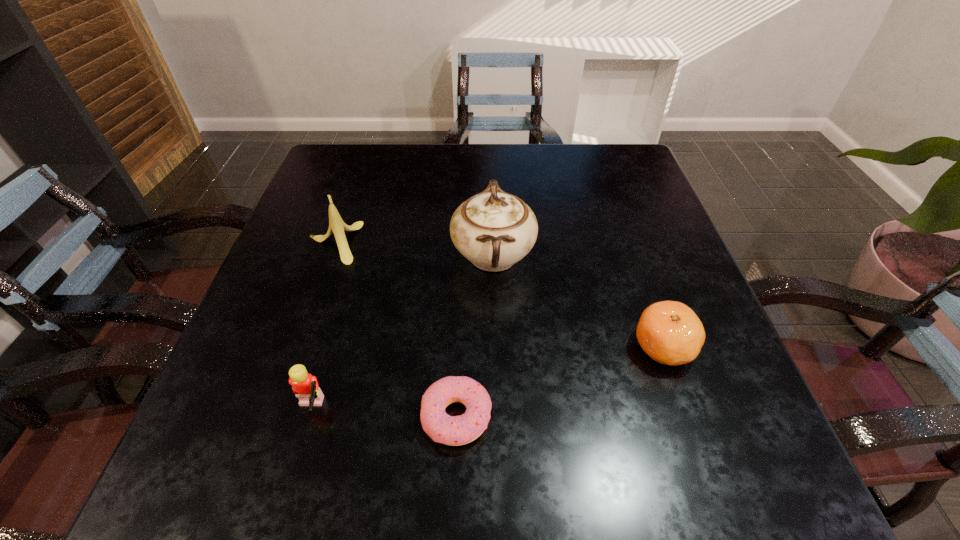
The height and width of the screenshot is (540, 960). What are the coordinates of `vacant space located on the back of the doughnut` in the screenshot? It's located at (464, 234).

The image size is (960, 540). I want to click on object that is at the near edge, so click(450, 430).

Where is `banana located at the left edge`? This screenshot has width=960, height=540. banana located at the left edge is located at coordinates [336, 225].

Identify the location of Lego located at the left edge. (305, 386).

Where is `object situated at the right edge`? object situated at the right edge is located at coordinates click(x=669, y=332).

In the image, there is a desktop. Where is `blank space at the far edge`? blank space at the far edge is located at coordinates (405, 145).

This screenshot has width=960, height=540. In order to click on vacant space at the near edge of the desktop in this screenshot , I will do `click(564, 451)`.

Locate an element on the screen. Image resolution: width=960 pixels, height=540 pixels. free space at the left edge of the desktop is located at coordinates (321, 231).

The height and width of the screenshot is (540, 960). Identify the location of vacant space at the right edge of the desktop. (643, 212).

Locate an element on the screen. vacant space at the far left corner of the desktop is located at coordinates (324, 188).